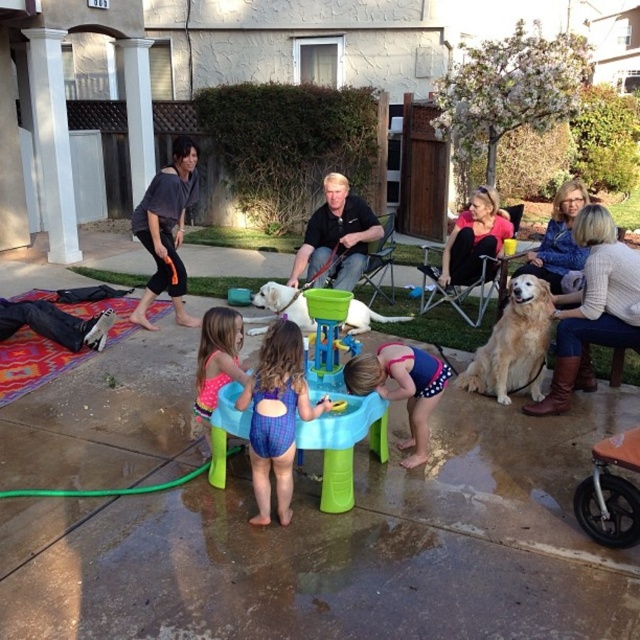
Is the position of gray cotton shirt at upper center less distant than that of blue swimsuit at center?

That is False.

What do you see at coordinates (166, 230) in the screenshot? I see `gray cotton shirt at upper center` at bounding box center [166, 230].

The width and height of the screenshot is (640, 640). In order to click on gray cotton shirt at upper center in this screenshot , I will do `click(166, 230)`.

I want to click on gray cotton shirt at upper center, so click(x=166, y=230).

Is point (506, 326) more distant than point (260, 326)?

No, (506, 326) is closer to viewer.

Who is more distant from viewer, (x=525, y=368) or (x=264, y=296)?

Positioned behind is point (x=264, y=296).

Find the location of `golden fur dog at right`. golden fur dog at right is located at coordinates (513, 344).

Can you confirm if blue plaid swimsuit at center is positioned above pink polka dot swimsuit at center?

Actually, blue plaid swimsuit at center is below pink polka dot swimsuit at center.

Can you confirm if blue plaid swimsuit at center is smaller than pink polka dot swimsuit at center?

No, blue plaid swimsuit at center is not smaller than pink polka dot swimsuit at center.

I want to click on blue plaid swimsuit at center, so click(x=276, y=417).

Where is `blue plaid swimsuit at center`? blue plaid swimsuit at center is located at coordinates (276, 417).